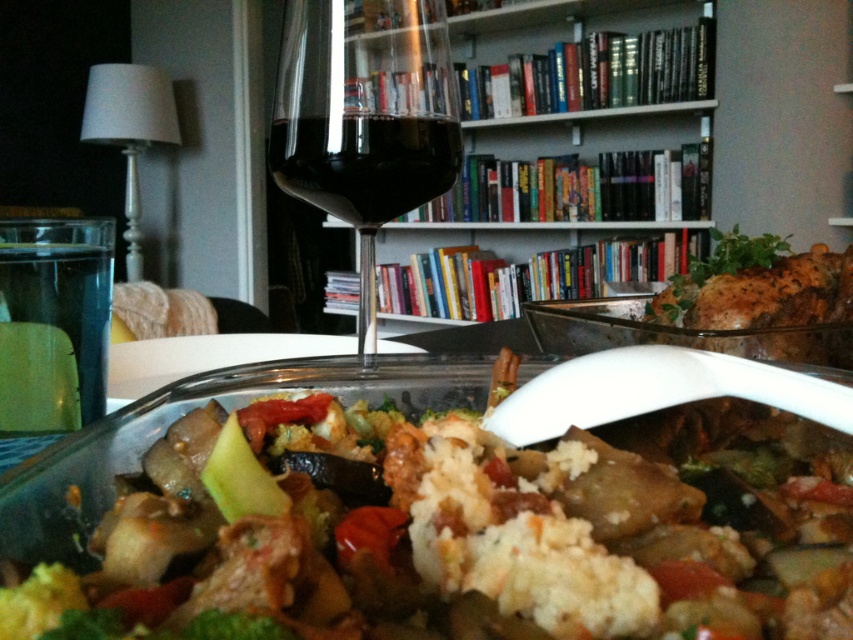
Based on the photo, you are a guest at a dinner party and want to reach for the white creamy rice at center and the hardcover books at upper center. Which item is closer to you?

The white creamy rice at center is closer to you because it is located below the hardcover books at upper center, which are further away.